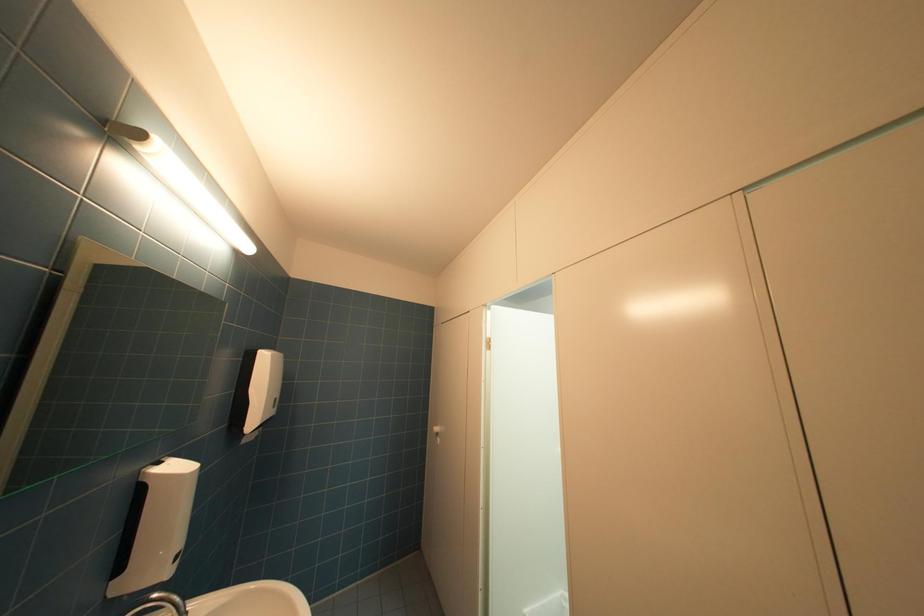
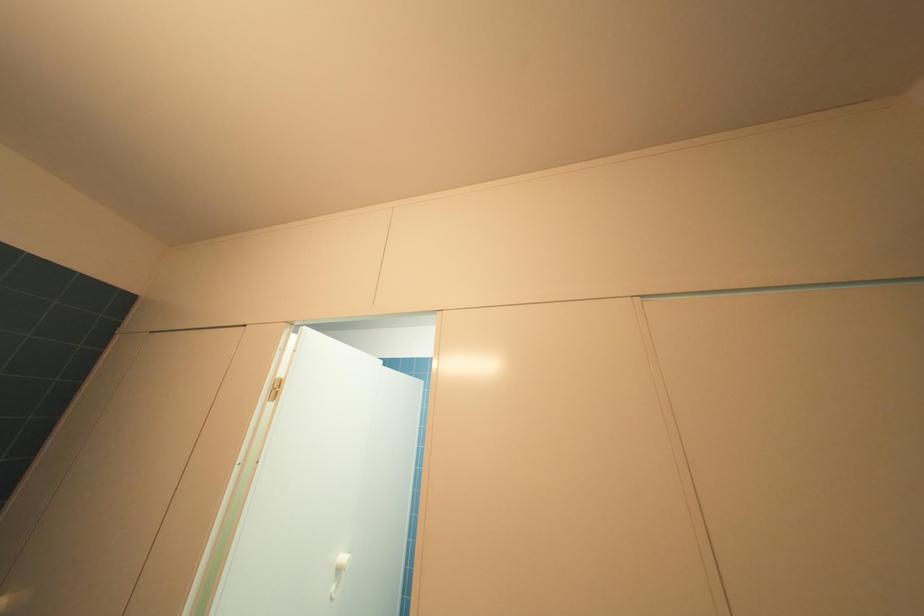
Question: The camera is either moving clockwise (left) or counter-clockwise (right) around the object. The first image is from the beginning of the video and the second image is from the end. Is the camera moving left or right when shooting the video?

Choices:
 (A) Left
 (B) Right

Answer: (A)